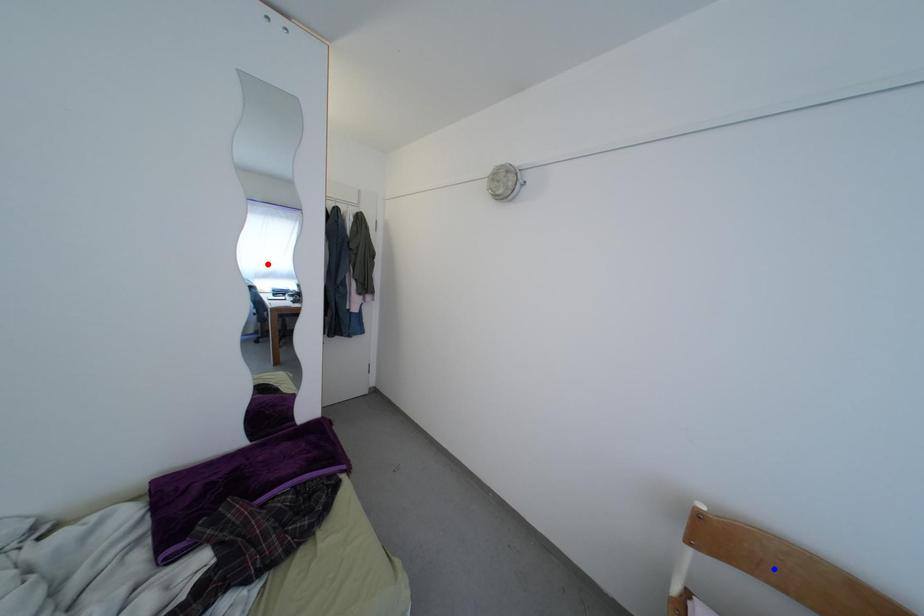
Question: In the image, two points are highlighted. Which point is nearer to the camera? Reply with the corresponding letter.

Choices:
 (A) blue point
 (B) red point

Answer: (A)